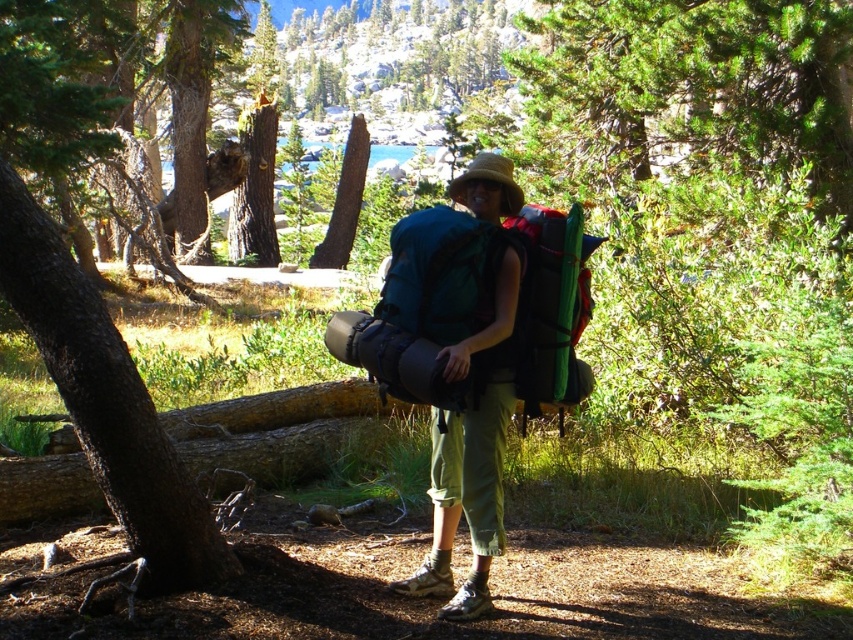
Question: Can you confirm if matte green backpack at center is thinner than green fabric backpack at center?

Choices:
 (A) yes
 (B) no

Answer: (B)

Question: Can you confirm if dark brown bark at left is positioned to the left of green fabric backpack at center?

Choices:
 (A) no
 (B) yes

Answer: (B)

Question: Does matte blue backpack at center have a lesser width compared to green fabric backpack at center?

Choices:
 (A) no
 (B) yes

Answer: (A)

Question: Which of the following is the closest to the observer?

Choices:
 (A) green fabric backpack at center
 (B) matte blue backpack at center
 (C) matte green backpack at center
 (D) dark brown bark at left

Answer: (D)

Question: Among these points, which one is nearest to the camera?

Choices:
 (A) (480, 588)
 (B) (515, 225)

Answer: (A)

Question: Which of the following is the farthest from the observer?

Choices:
 (A) dark brown bark at left
 (B) green fabric backpack at center
 (C) matte green backpack at center
 (D) matte blue backpack at center

Answer: (B)